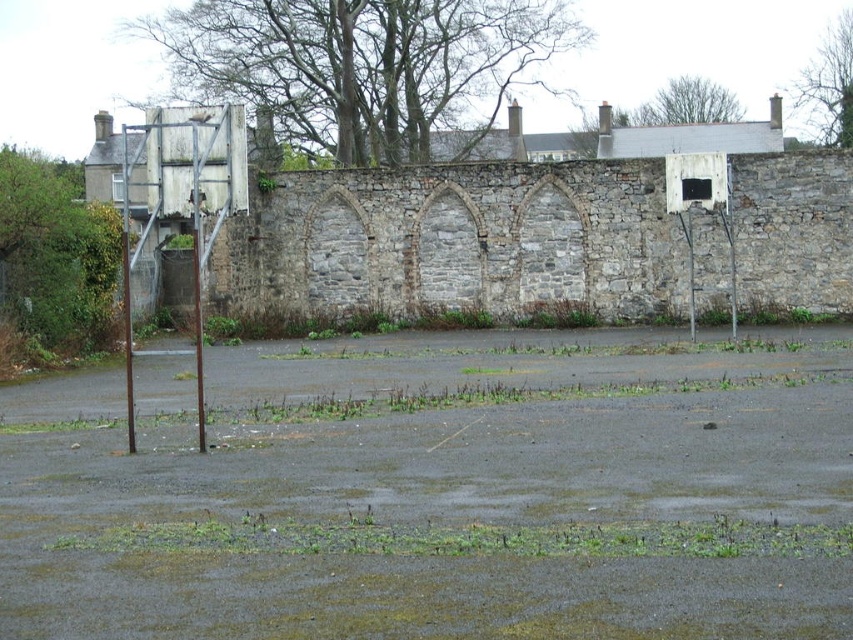
Question: Where is metallic gray basketball hoop at left located in relation to white painted metal basketball hoop at right in the image?

Choices:
 (A) below
 (B) above

Answer: (B)

Question: Is metallic gray basketball hoop at left smaller than white painted metal basketball hoop at right?

Choices:
 (A) no
 (B) yes

Answer: (A)

Question: Does metallic gray basketball hoop at left appear under white painted metal basketball hoop at right?

Choices:
 (A) no
 (B) yes

Answer: (A)

Question: Which object is farther from the camera taking this photo?

Choices:
 (A) metallic gray basketball hoop at left
 (B) white painted metal basketball hoop at right

Answer: (B)

Question: Among these points, which one is farthest from the camera?

Choices:
 (A) (683, 177)
 (B) (201, 400)

Answer: (A)